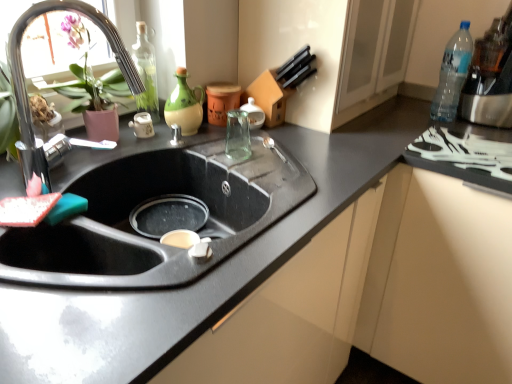
Question: Does point (167, 115) appear closer or farther from the camera than point (454, 99)?

Choices:
 (A) closer
 (B) farther

Answer: (A)

Question: From the image's perspective, is green matte jug at upper center, which is the second bottle in left-to-right order, above or below clear plastic bottle at upper right, which is the third bottle in left-to-right order?

Choices:
 (A) below
 (B) above

Answer: (A)

Question: Which object is positioned closest to the transparent glass bottle at upper left, which is the 1th bottle in left-to-right order?

Choices:
 (A) chrome metallic faucet at upper left
 (B) clear plastic bottle at upper right, the first bottle viewed from the right
 (C) green matte jug at upper center, which is the second bottle in left-to-right order
 (D) white plastic tray at right
 (E) matte ceramic teapot at center

Answer: (C)

Question: Which object is positioned closest to the clear plastic bottle at upper right, the first bottle viewed from the right?

Choices:
 (A) matte ceramic teapot at center
 (B) white plastic tray at right
 (C) transparent glass bottle at upper left, which is the 1th bottle in left-to-right order
 (D) chrome metallic faucet at upper left
 (E) green matte jug at upper center, which is the second bottle in left-to-right order

Answer: (B)